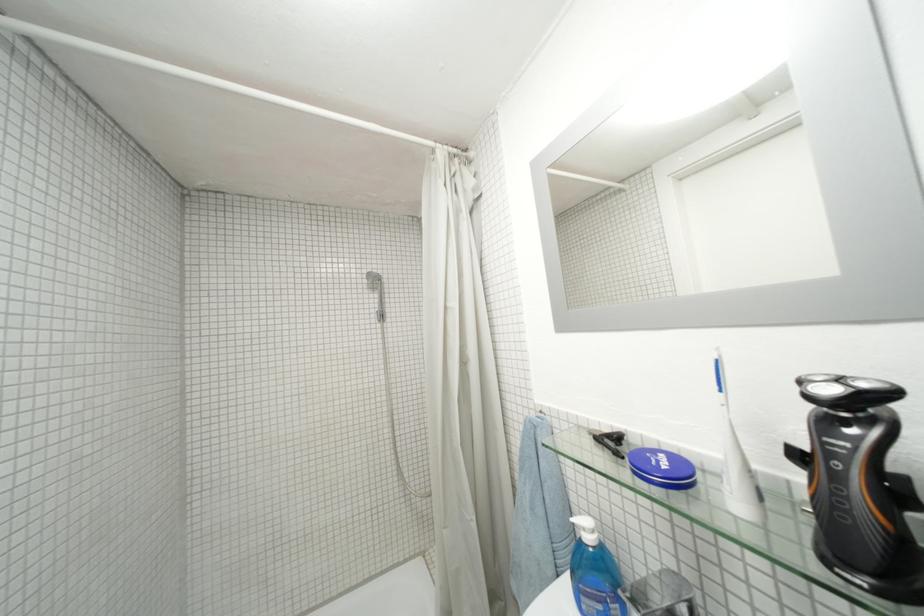
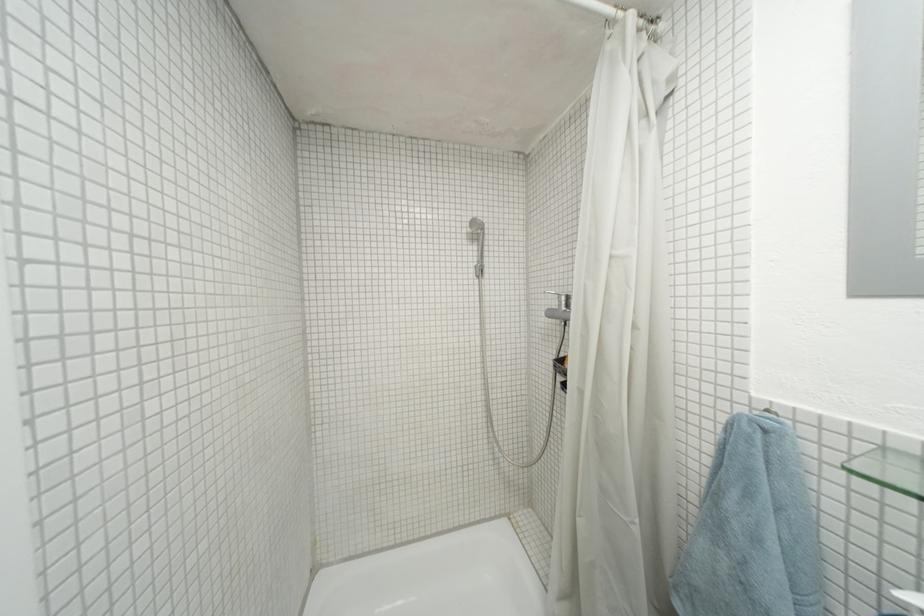
The images are taken continuously from a first-person perspective. In which direction are you moving?

The cameraman moved toward left, forward.